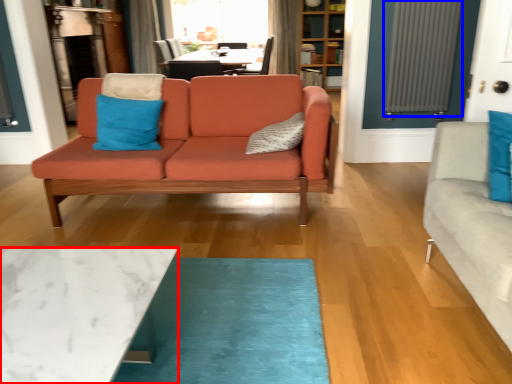
Question: Which object is closer to the camera taking this photo, coffee table (highlighted by a red box) or radiator (highlighted by a blue box)?

Choices:
 (A) coffee table
 (B) radiator

Answer: (A)